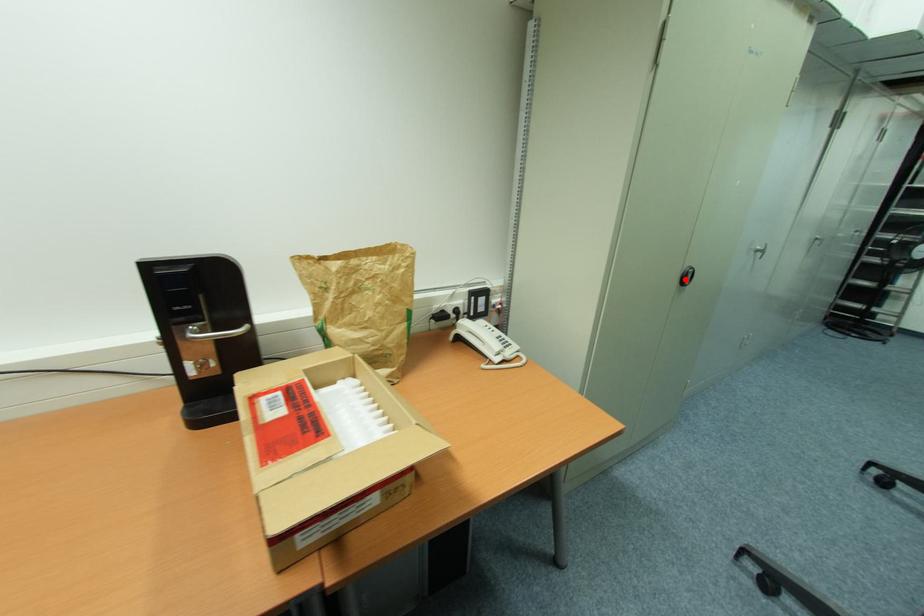
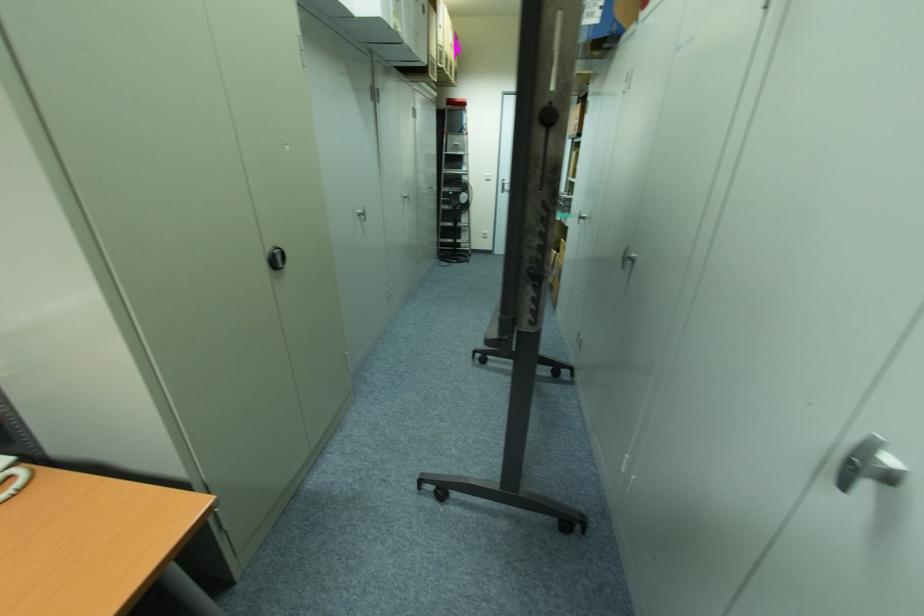
Find the pixel in the second image that matches the highlighted location in the first image.

(278, 262)